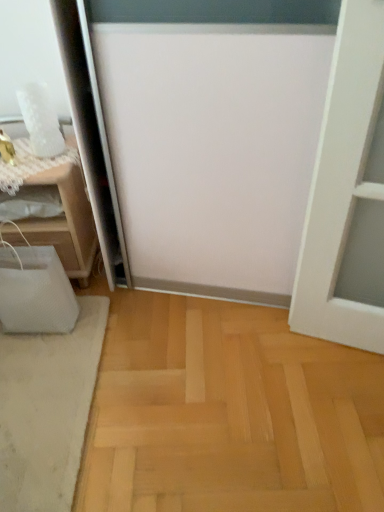
Question: In the image, is white soft rug at lower left positioned in front of or behind white mesh bag at left?

Choices:
 (A) front
 (B) behind

Answer: (A)

Question: From a real-world perspective, is white soft rug at lower left physically located above or below white mesh bag at left?

Choices:
 (A) above
 (B) below

Answer: (B)

Question: Considering the positions of white soft rug at lower left and white mesh bag at left in the image, is white soft rug at lower left wider or thinner than white mesh bag at left?

Choices:
 (A) thin
 (B) wide

Answer: (B)

Question: In terms of width, does white mesh bag at left look wider or thinner when compared to white soft rug at lower left?

Choices:
 (A) thin
 (B) wide

Answer: (A)

Question: Relative to white soft rug at lower left, is white mesh bag at left in front or behind?

Choices:
 (A) behind
 (B) front

Answer: (A)

Question: From a real-world perspective, relative to white soft rug at lower left, is white mesh bag at left vertically above or below?

Choices:
 (A) below
 (B) above

Answer: (B)

Question: Would you say white mesh bag at left is to the left or to the right of white soft rug at lower left in the picture?

Choices:
 (A) right
 (B) left

Answer: (B)